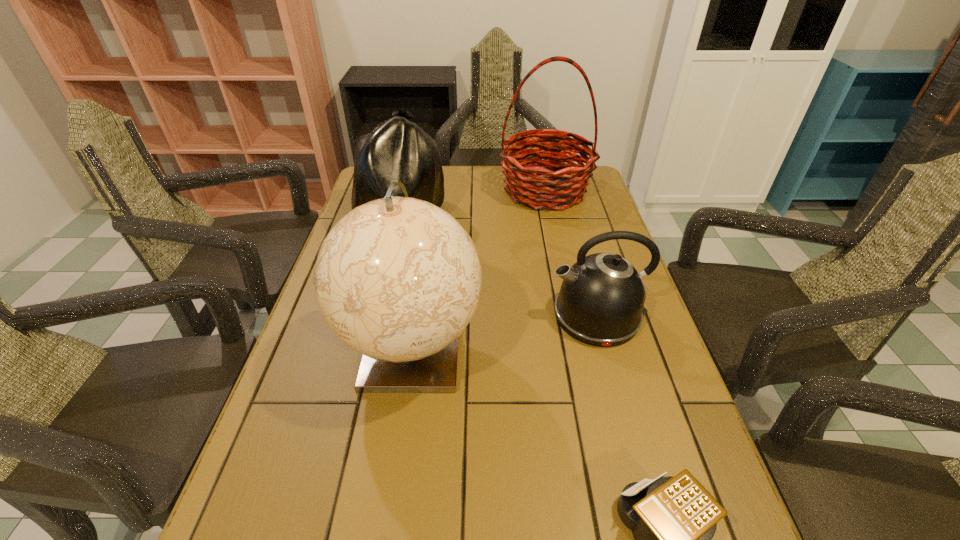
This screenshot has height=540, width=960. What are the coordinates of `vacant space at the right edge of the desktop` in the screenshot? It's located at (689, 420).

This screenshot has height=540, width=960. What are the coordinates of `blank region between the plastic bag and the basket` in the screenshot? It's located at (472, 205).

Locate which object ranks third in proximity to the plastic bag. Please provide its 2D coordinates. Your answer should be formatted as a tuple, i.e. [(x, y)], where the tuple contains the x and y coordinates of a point satisfying the conditions above.

[(601, 299)]

Locate which object ranks fourth in proximity to the basket. Please provide its 2D coordinates. Your answer should be formatted as a tuple, i.e. [(x, y)], where the tuple contains the x and y coordinates of a point satisfying the conditions above.

[(673, 519)]

This screenshot has width=960, height=540. I want to click on vacant space that satisfies the following two spatial constraints: 1. on the spout of the second shortest object; 2. on the surface of the globe showing Europe and Africa, so click(607, 349).